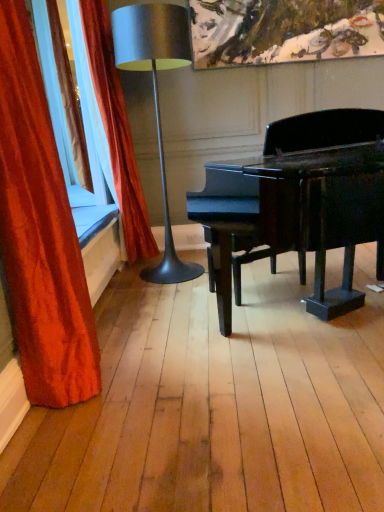
Locate an element on the screen. vacant area in front of velvet red curtain at left, the second curtain viewed from the back is located at coordinates (77, 437).